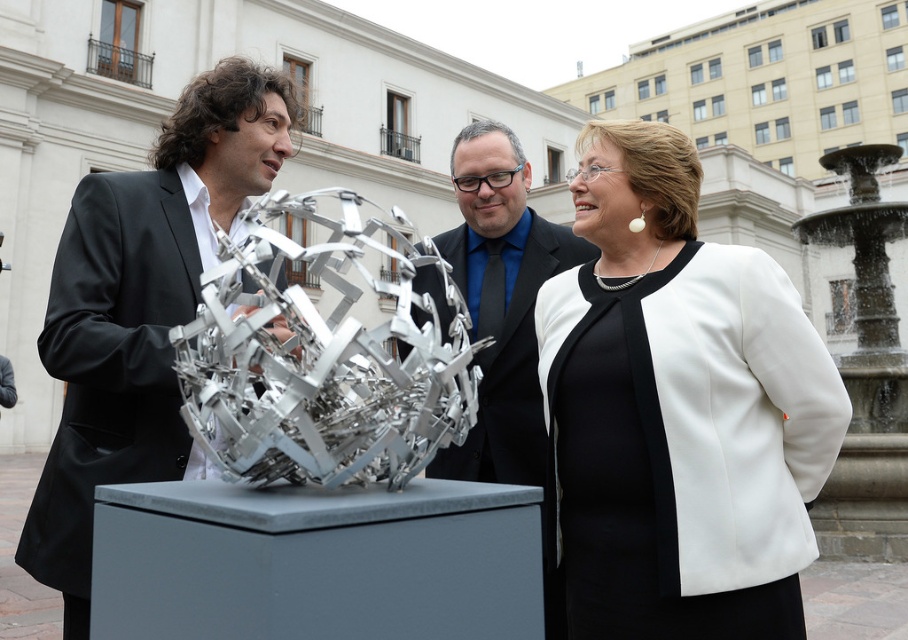
Question: Estimate the real-world distances between objects in this image. Which object is closer to the shiny silver sculpture at center?

Choices:
 (A) white matte blazer at center
 (B) shiny metallic sculpture at center

Answer: (B)

Question: Which point is farther to the camera?

Choices:
 (A) white matte blazer at center
 (B) shiny metallic sculpture at center
 (C) shiny silver sculpture at center

Answer: (B)

Question: Is white matte blazer at center positioned before shiny silver sculpture at center?

Choices:
 (A) no
 (B) yes

Answer: (A)

Question: Is shiny silver sculpture at center positioned behind shiny metallic sculpture at center?

Choices:
 (A) no
 (B) yes

Answer: (A)

Question: Which point is farther to the camera?

Choices:
 (A) shiny silver sculpture at center
 (B) white matte blazer at center
 (C) shiny metallic sculpture at center

Answer: (C)

Question: Is shiny silver sculpture at center bigger than shiny metallic sculpture at center?

Choices:
 (A) yes
 (B) no

Answer: (A)